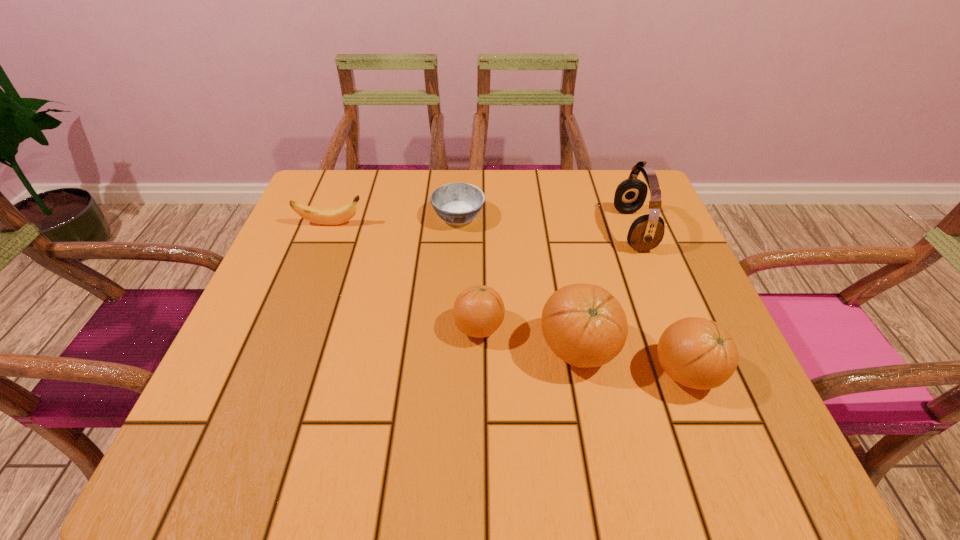
Where is `vacant area situated 0.140m on the back of the fourth object from left to right`? The width and height of the screenshot is (960, 540). vacant area situated 0.140m on the back of the fourth object from left to right is located at coordinates (563, 269).

Find the location of `blank space located 0.180m on the left of the rightmost orange`. blank space located 0.180m on the left of the rightmost orange is located at coordinates (549, 373).

Where is `vacant space located on the right of the shortest object`? The height and width of the screenshot is (540, 960). vacant space located on the right of the shortest object is located at coordinates (505, 217).

Find the location of a particular element. Image resolution: width=960 pixels, height=540 pixels. vacant region located on the ear cups of the headset is located at coordinates (526, 230).

Image resolution: width=960 pixels, height=540 pixels. What are the coordinates of `vacant space situated 0.220m on the ear cups of the headset` in the screenshot? It's located at (526, 230).

This screenshot has width=960, height=540. I want to click on vacant region located 0.320m on the ear cups of the headset, so click(x=485, y=230).

You are a GUI agent. You are given a task and a screenshot of the screen. Output one action in this format:
    pyautogui.click(x=<x>, y=<y>)
    Task: Click on the vacant area situated at the stem of the banana
    The width and height of the screenshot is (960, 540).
    Given the screenshot: What is the action you would take?
    pyautogui.click(x=459, y=224)

I want to click on ashtray that is at the far edge, so click(455, 203).

The height and width of the screenshot is (540, 960). In order to click on headset that is at the far edge in this screenshot , I will do `click(646, 232)`.

You are a GUI agent. You are given a task and a screenshot of the screen. Output one action in this format:
    pyautogui.click(x=<x>, y=<y>)
    Task: Click on the banana positioned at the far edge
    
    Given the screenshot: What is the action you would take?
    (x=321, y=216)